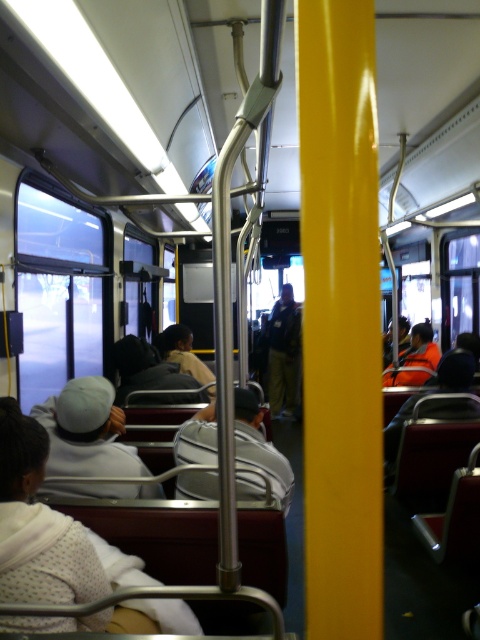
Can you confirm if gray fabric backpack at center is positioned below light brown leather jacket at center?

Yes.

Who is more forward, [259,474] or [203,369]?

Positioned in front is point [259,474].

Locate an element on the screen. gray fabric backpack at center is located at coordinates (257, 456).

Can you confirm if white matte cap at center is taller than dark gray leather jacket at center?

Incorrect, white matte cap at center's height is not larger of dark gray leather jacket at center's.

Which is behind, point (101, 458) or point (269, 381)?

The point (269, 381) is more distant.

Find the location of `white matte cap at center`. white matte cap at center is located at coordinates (86, 432).

Does gray fabric backpack at center appear on the right side of dark gray leather jacket at center?

Incorrect, gray fabric backpack at center is not on the right side of dark gray leather jacket at center.

Measure the distance from gray fabric backpack at center to dark gray leather jacket at center.

A distance of 4.94 meters exists between gray fabric backpack at center and dark gray leather jacket at center.

Image resolution: width=480 pixels, height=640 pixels. Find the location of `gray fabric backpack at center`. gray fabric backpack at center is located at coordinates (257, 456).

Find the location of a particular element. gray fabric backpack at center is located at coordinates (257, 456).